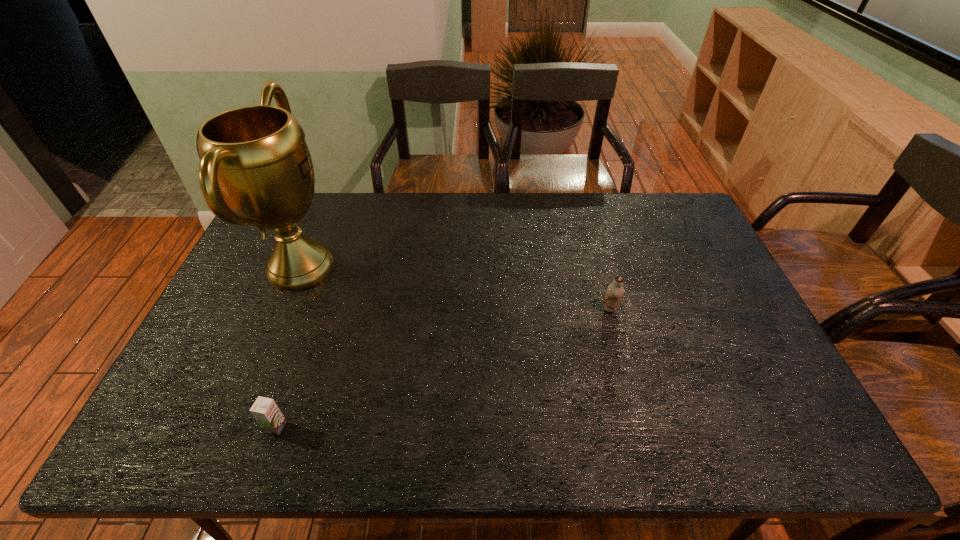
Image resolution: width=960 pixels, height=540 pixels. In order to click on trophy cup in this screenshot , I will do `click(255, 159)`.

At what (x,y) coordinates should I click in order to perform the action: click on the rightmost object. Please return your answer as a coordinate pair (x, y). The image size is (960, 540). Looking at the image, I should click on (615, 290).

At what (x,y) coordinates should I click in order to perform the action: click on the farther chocolate milk. Please return your answer as a coordinate pair (x, y). This screenshot has height=540, width=960. Looking at the image, I should click on (615, 290).

This screenshot has width=960, height=540. I want to click on the nearer chocolate milk, so click(x=265, y=411).

This screenshot has height=540, width=960. Identify the location of the nearest object. (265, 411).

At what (x,y) coordinates should I click in order to perform the action: click on vacant space located 0.210m on the surface of the tallest object with symbols. Please return your answer as a coordinate pair (x, y). The width and height of the screenshot is (960, 540). Looking at the image, I should click on (408, 267).

Identify the location of free region located 0.290m on the back of the rightmost object. (590, 238).

Locate an element on the screen. free spot located 0.200m on the right of the nearest object is located at coordinates (372, 427).

The image size is (960, 540). What are the coordinates of `object that is at the far edge` in the screenshot? It's located at (255, 159).

In order to click on object that is at the near edge in this screenshot , I will do `click(265, 411)`.